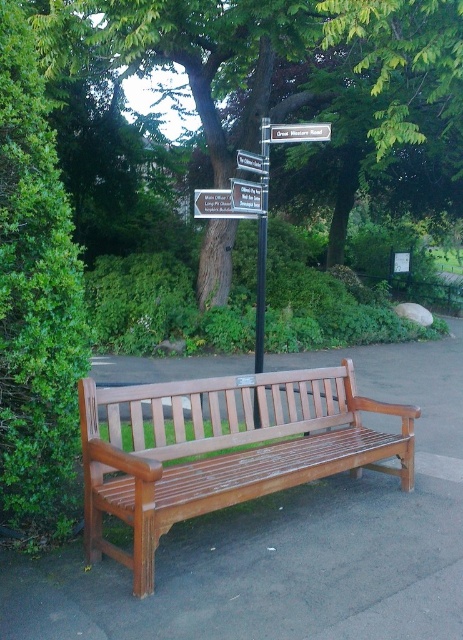
You are standing at the point marked by the coordinates point (294, 86). Looking around, you see a green leafy tree at center. Which direction should you face to see the wooden bench situated on a paved pathway?

The point (294, 86) is located at the green leafy tree at center. The wooden bench situated on a paved pathway is positioned slightly off center in the frame facing towards the right side. To see the bench from the tree, you should face the direction where the bench is positioned, which is slightly off center and facing right.

You are standing at the point labeled as point [223,449] in the image. What object are you directly facing?

The point [223,449] indicates the polished wood bench at center, so you are directly facing the polished wood bench at center.